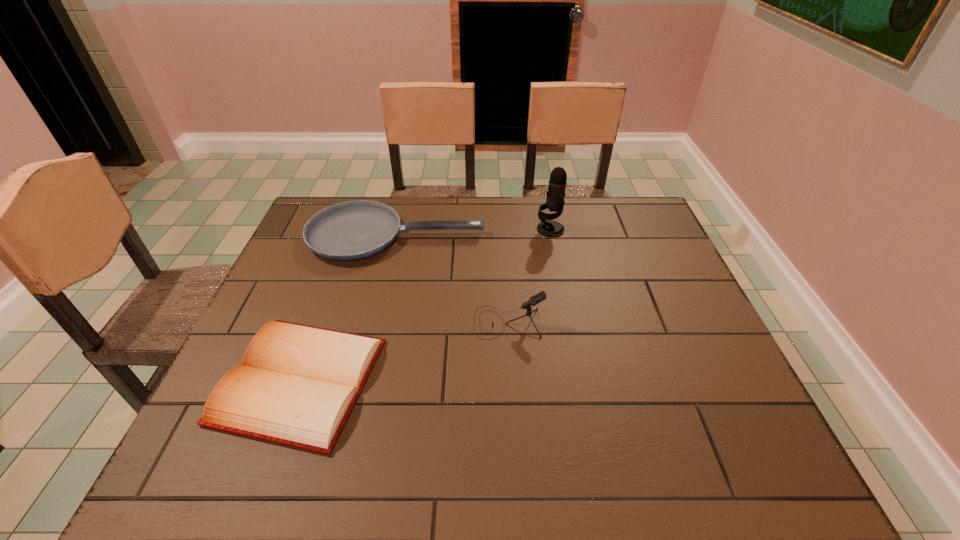
Find the location of a particular element. The image size is (960, 540). vacant region located on the right of the frying pan is located at coordinates (600, 236).

Locate an element on the screen. The width and height of the screenshot is (960, 540). free spot located 0.220m on the back of the Bible is located at coordinates (342, 265).

Find the location of a particular element. microphone at the far edge is located at coordinates (547, 227).

Find the location of a particular element. Image resolution: width=960 pixels, height=540 pixels. frying pan that is positioned at the far edge is located at coordinates (351, 230).

Identify the location of object that is positioned at the near edge. This screenshot has height=540, width=960. (297, 385).

Identify the location of frying pan situated at the left edge. This screenshot has height=540, width=960. pos(351,230).

This screenshot has width=960, height=540. In order to click on Bible that is at the left edge in this screenshot , I will do `click(297, 385)`.

You are a GUI agent. You are given a task and a screenshot of the screen. Output one action in this format:
    pyautogui.click(x=<x>, y=<y>)
    Task: Click on the object at the far left corner
    
    Given the screenshot: What is the action you would take?
    pyautogui.click(x=351, y=230)

Locate an element on the screen. The height and width of the screenshot is (540, 960). object that is at the near left corner is located at coordinates (297, 385).

In the image, there is a desktop. Where is `blank space at the far edge`? The height and width of the screenshot is (540, 960). blank space at the far edge is located at coordinates (582, 209).